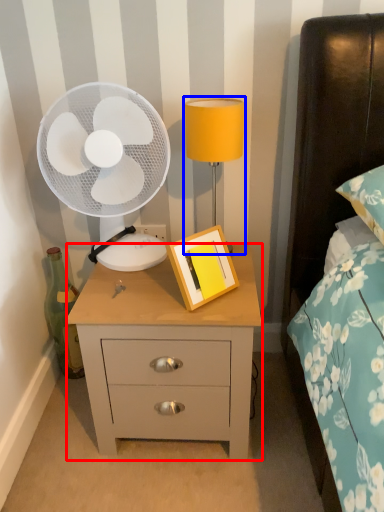
Question: Among these objects, which one is nearest to the camera, nightstand (highlighted by a red box) or bedside lamp (highlighted by a blue box)?

Choices:
 (A) nightstand
 (B) bedside lamp

Answer: (A)